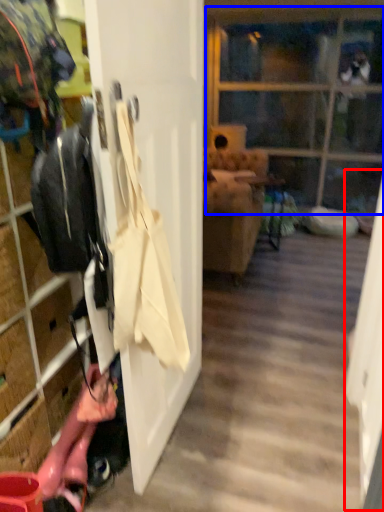
Question: Which object is closer to the camera taking this photo, screen door (highlighted by a red box) or glass door (highlighted by a blue box)?

Choices:
 (A) screen door
 (B) glass door

Answer: (A)